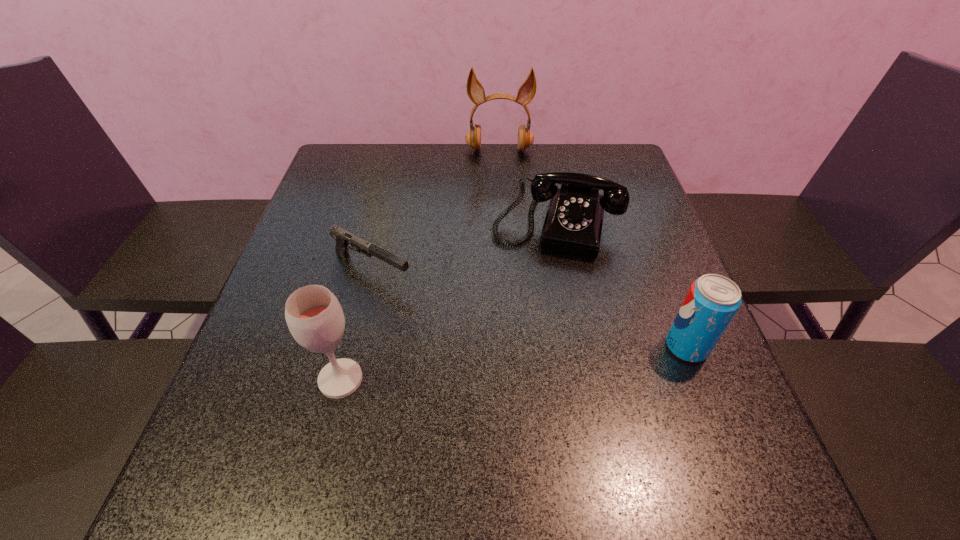
Identify the location of free spot between the shortest object and the telephone. The height and width of the screenshot is (540, 960). (463, 247).

Locate an element on the screen. free space between the farthest object and the shortest object is located at coordinates (436, 211).

Find the location of a particular element. The width and height of the screenshot is (960, 540). vacant space that is in between the shortest object and the soda can is located at coordinates (529, 308).

Find the location of a particular element. The height and width of the screenshot is (540, 960). free space between the wineglass and the gun is located at coordinates (356, 325).

This screenshot has height=540, width=960. Identify the location of empty space that is in between the second tallest object and the telephone. (447, 301).

This screenshot has height=540, width=960. Identify the location of free space between the tallest object and the wineglass. (420, 265).

Find the location of a particular element. The height and width of the screenshot is (540, 960). blank region between the rightmost object and the telephone is located at coordinates (621, 285).

The image size is (960, 540). Identify the location of object that ranks as the closest to the telephone. (475, 90).

Choose which object is the fourth nearest neighbor to the farthest object. Please provide its 2D coordinates. Your answer should be formatted as a tuple, i.e. [(x, y)], where the tuple contains the x and y coordinates of a point satisfying the conditions above.

[(314, 316)]

The image size is (960, 540). Identify the location of vacant region that satisfies the following two spatial constraints: 1. on the front side of the earphone; 2. on the left side of the telephone. (503, 224).